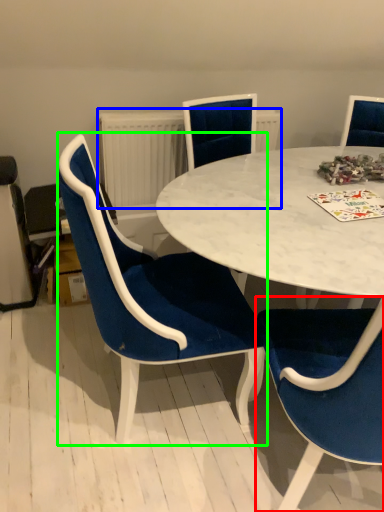
Question: Considering the real-world distances, which object is farthest from chair (highlighted by a red box)? radiator (highlighted by a blue box) or chair (highlighted by a green box)?

Choices:
 (A) radiator
 (B) chair

Answer: (A)